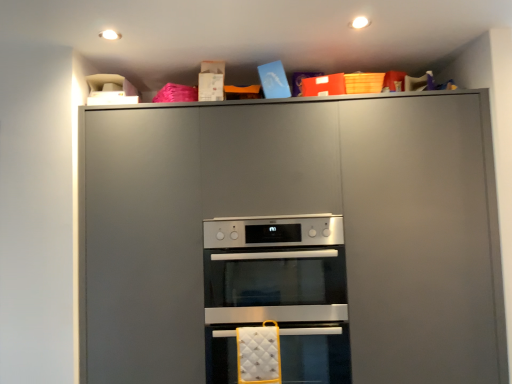
Question: Considering the relative positions of satin silver oven at center, placed as the 2th oven when sorted from bottom to top, and matte gray cabinet at upper center in the image provided, is satin silver oven at center, placed as the 2th oven when sorted from bottom to top, in front of matte gray cabinet at upper center?

Choices:
 (A) yes
 (B) no

Answer: (B)

Question: Is satin silver oven at center, positioned as the first oven in top-to-bottom order, wider than matte gray cabinet at upper center?

Choices:
 (A) yes
 (B) no

Answer: (A)

Question: Considering the relative sizes of satin silver oven at center, positioned as the first oven in top-to-bottom order, and matte gray cabinet at upper center in the image provided, is satin silver oven at center, positioned as the first oven in top-to-bottom order, bigger than matte gray cabinet at upper center?

Choices:
 (A) yes
 (B) no

Answer: (B)

Question: Is satin silver oven at center, positioned as the first oven in top-to-bottom order, placed right next to matte gray cabinet at upper center?

Choices:
 (A) no
 (B) yes

Answer: (A)

Question: Is satin silver oven at center, placed as the 2th oven when sorted from bottom to top, at the right side of matte gray cabinet at upper center?

Choices:
 (A) yes
 (B) no

Answer: (B)

Question: Is matte gray cabinet at upper center in front of or behind silver metallic oven at center, the second oven viewed from the top, in the image?

Choices:
 (A) behind
 (B) front

Answer: (B)

Question: Is matte gray cabinet at upper center spatially inside silver metallic oven at center, the second oven viewed from the top, or outside of it?

Choices:
 (A) inside
 (B) outside

Answer: (B)

Question: Based on their positions, is matte gray cabinet at upper center located to the left or right of silver metallic oven at center, which is the first oven from bottom to top?

Choices:
 (A) left
 (B) right

Answer: (B)

Question: Considering the positions of point (287, 299) and point (282, 344), is point (287, 299) closer or farther from the camera than point (282, 344)?

Choices:
 (A) farther
 (B) closer

Answer: (B)

Question: Do you think matte gray cabinet at upper center is within satin silver oven at center, placed as the 2th oven when sorted from bottom to top, or outside of it?

Choices:
 (A) outside
 (B) inside

Answer: (A)

Question: Visually, is matte gray cabinet at upper center positioned to the left or to the right of satin silver oven at center, positioned as the first oven in top-to-bottom order?

Choices:
 (A) right
 (B) left

Answer: (A)

Question: Considering the positions of matte gray cabinet at upper center and satin silver oven at center, positioned as the first oven in top-to-bottom order, in the image, is matte gray cabinet at upper center taller or shorter than satin silver oven at center, positioned as the first oven in top-to-bottom order,?

Choices:
 (A) short
 (B) tall

Answer: (B)

Question: Looking at their shapes, would you say matte gray cabinet at upper center is wider or thinner than satin silver oven at center, positioned as the first oven in top-to-bottom order?

Choices:
 (A) wide
 (B) thin

Answer: (B)

Question: Is satin silver oven at center, positioned as the first oven in top-to-bottom order, in front of or behind matte gray cabinet at upper center in the image?

Choices:
 (A) behind
 (B) front

Answer: (A)

Question: Considering the positions of point (245, 292) and point (468, 317), is point (245, 292) closer or farther from the camera than point (468, 317)?

Choices:
 (A) farther
 (B) closer

Answer: (A)